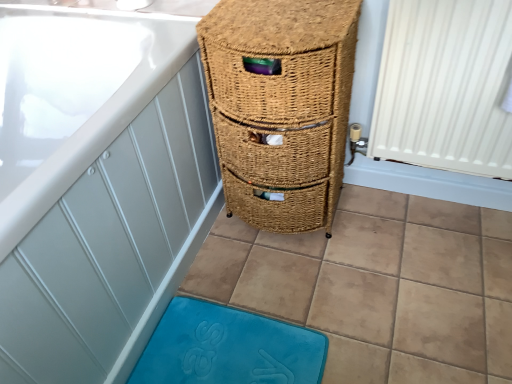
Locate an element on the screen. vacant space situated above blue plush bath mat at lower center (from a real-world perspective) is located at coordinates (229, 343).